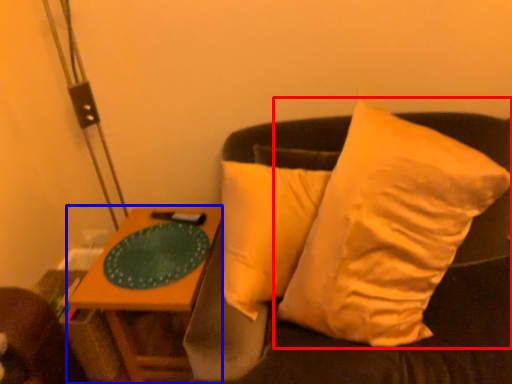
Question: Which object is closer to the camera taking this photo, pillow (highlighted by a red box) or table (highlighted by a blue box)?

Choices:
 (A) pillow
 (B) table

Answer: (A)